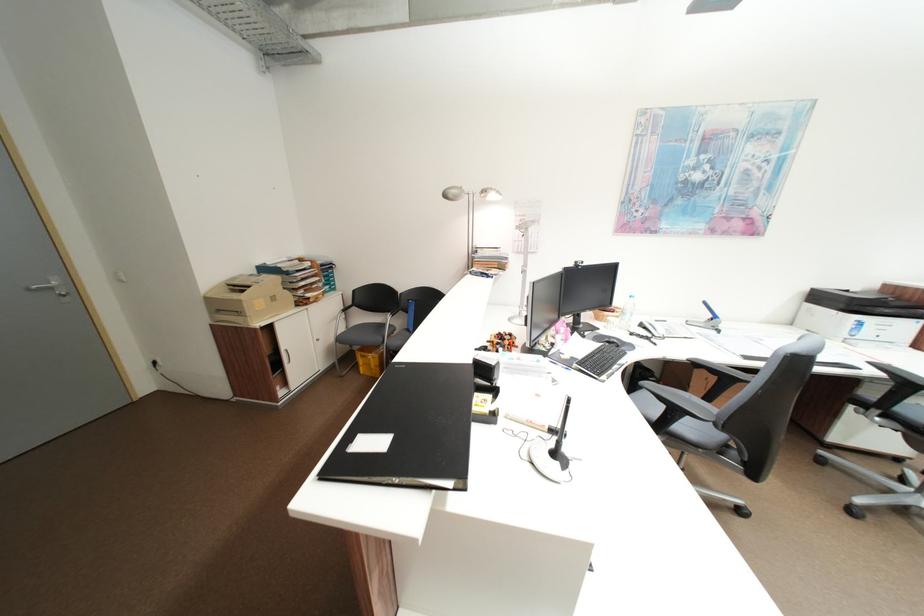
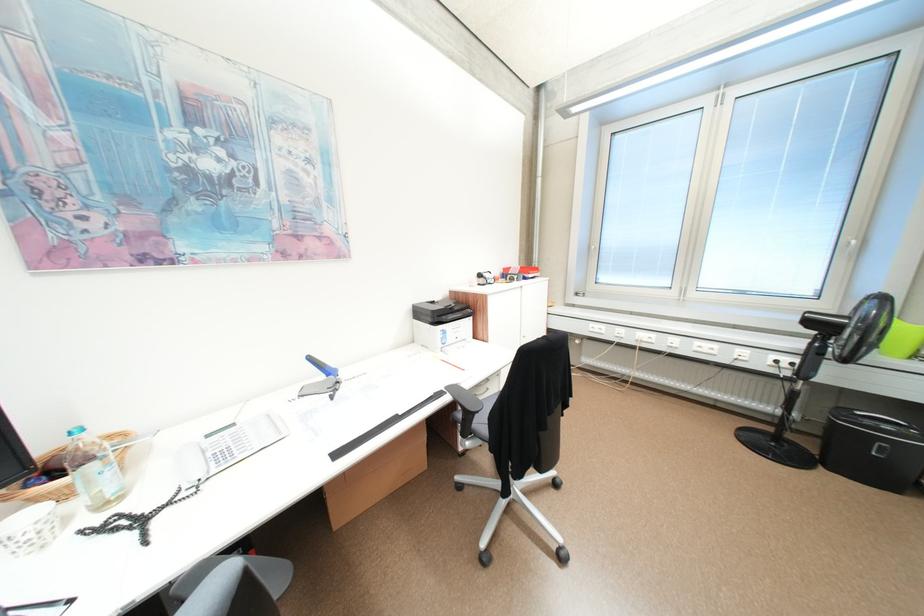
Locate, in the second image, the point that corresponds to point 714,304 in the first image.

(320, 359)